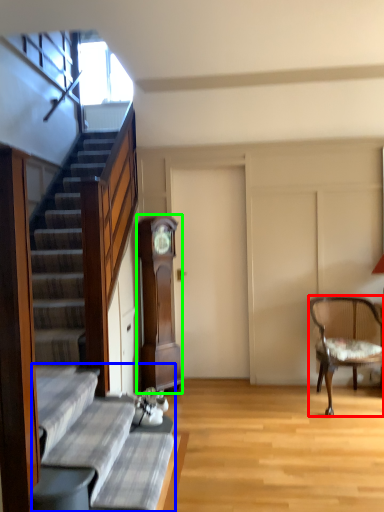
Question: Which object is positioned closest to chair (highlighted by a red box)? Select from couch (highlighted by a blue box) and cabinetry (highlighted by a green box).

Choices:
 (A) couch
 (B) cabinetry

Answer: (B)